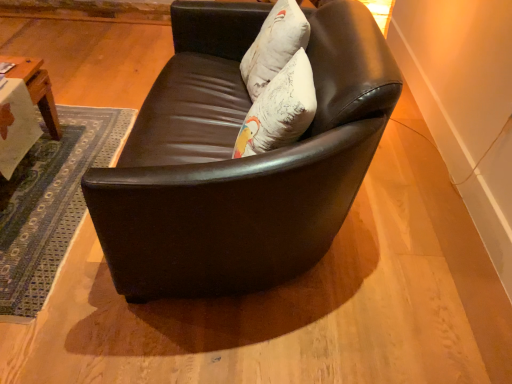
Question: Should I look upward or downward to see white textured pillow at upper center?

Choices:
 (A) down
 (B) up

Answer: (B)

Question: From the image's perspective, is matte black couch at center above white textured pillow at upper center?

Choices:
 (A) no
 (B) yes

Answer: (A)

Question: Is matte black couch at center wider than white textured pillow at upper center?

Choices:
 (A) no
 (B) yes

Answer: (B)

Question: Is matte black couch at center further to camera compared to white textured pillow at upper center?

Choices:
 (A) no
 (B) yes

Answer: (A)

Question: Is matte black couch at center shorter than white textured pillow at upper center?

Choices:
 (A) yes
 (B) no

Answer: (B)

Question: Does matte black couch at center contain white textured pillow at upper center?

Choices:
 (A) yes
 (B) no

Answer: (A)

Question: From a real-world perspective, is matte black couch at center positioned under white textured pillow at upper center based on gravity?

Choices:
 (A) no
 (B) yes

Answer: (B)

Question: From the image's perspective, is white textured pillow at upper center located beneath matte black couch at center?

Choices:
 (A) no
 (B) yes

Answer: (A)

Question: From the image's perspective, is white textured pillow at upper center on matte black couch at center?

Choices:
 (A) no
 (B) yes

Answer: (B)

Question: From a real-world perspective, does white textured pillow at upper center sit lower than matte black couch at center?

Choices:
 (A) no
 (B) yes

Answer: (A)

Question: Is white textured pillow at upper center behind matte black couch at center?

Choices:
 (A) no
 (B) yes

Answer: (B)

Question: Does white textured pillow at upper center have a smaller size compared to matte black couch at center?

Choices:
 (A) no
 (B) yes

Answer: (B)

Question: Is white textured pillow at upper center at the right side of matte black couch at center?

Choices:
 (A) yes
 (B) no

Answer: (A)

Question: In terms of height, does white textured pillow at upper center look taller or shorter compared to matte black couch at center?

Choices:
 (A) tall
 (B) short

Answer: (B)